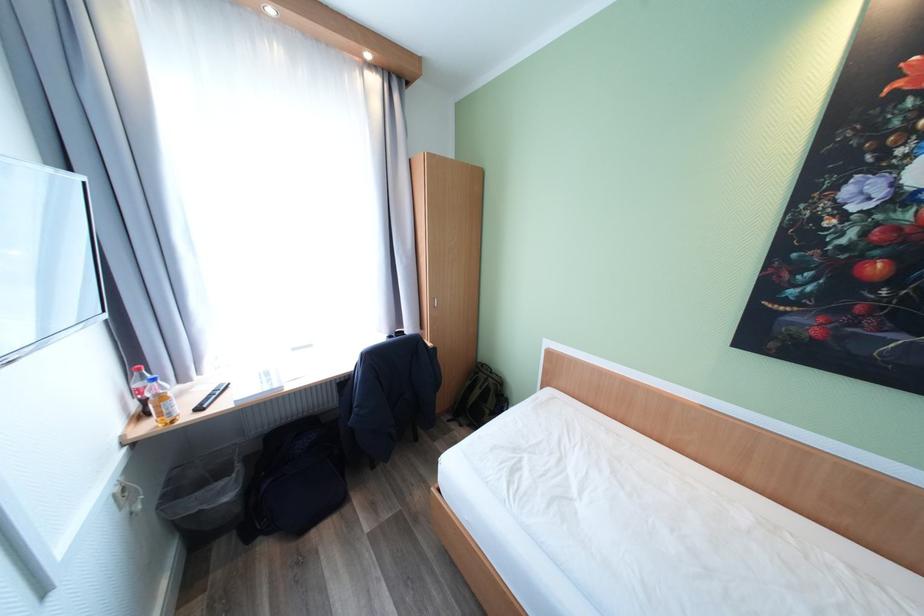
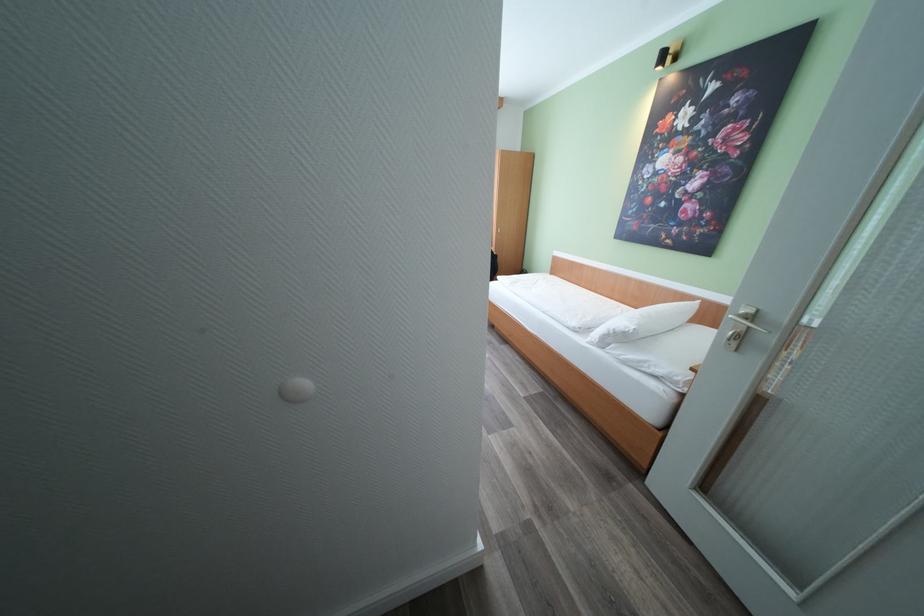
Question: The images are taken continuously from a first-person perspective. In which direction are you moving?

Choices:
 (A) Left
 (B) Right
 (C) Forward
 (D) Backward

Answer: (D)